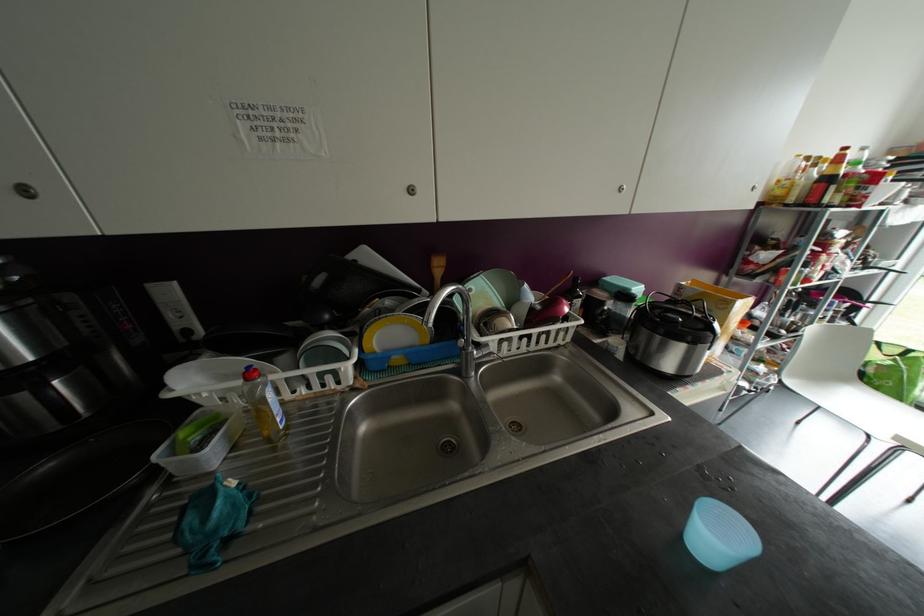
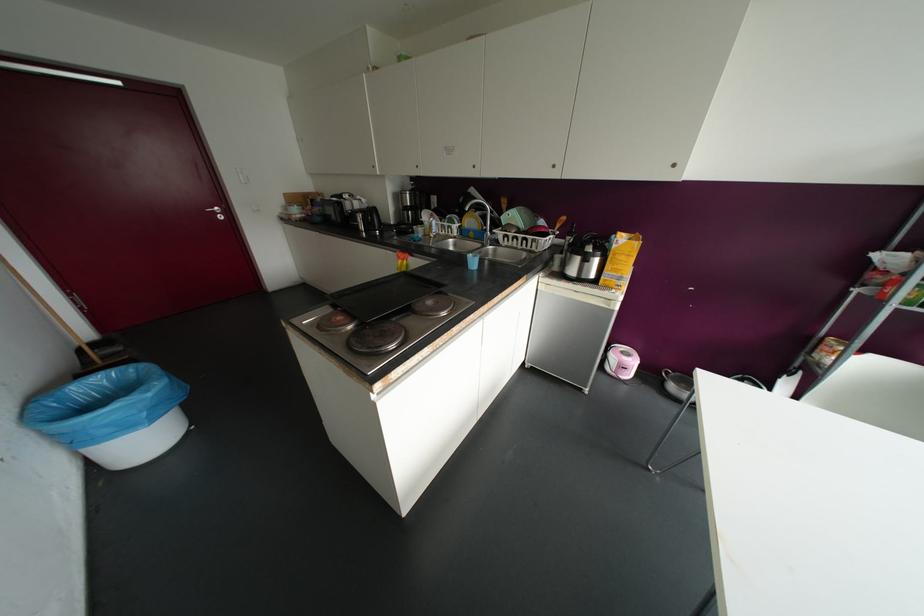
In the second image, find the point that corresponds to point (752, 188) in the first image.

(673, 164)